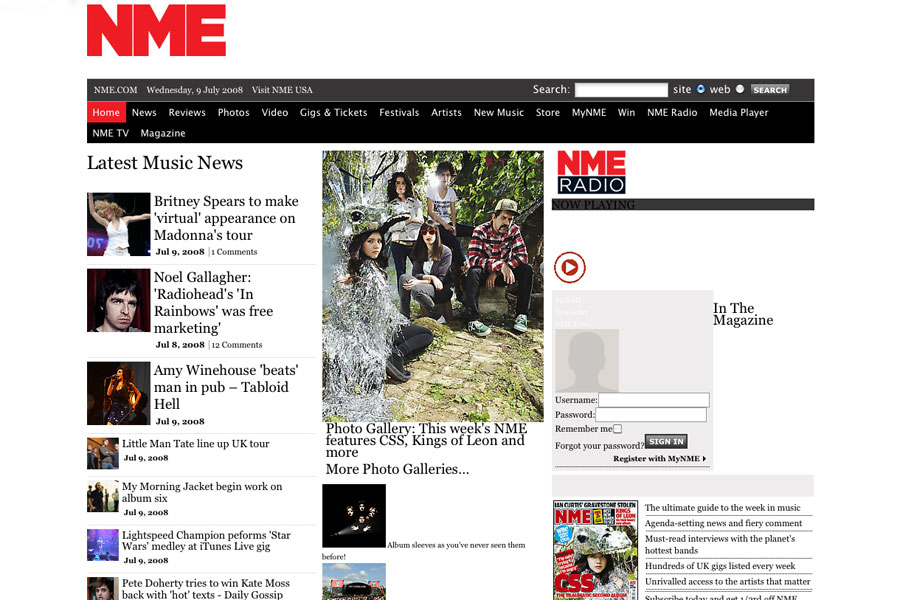
Identify the location of pictures. (426, 259).